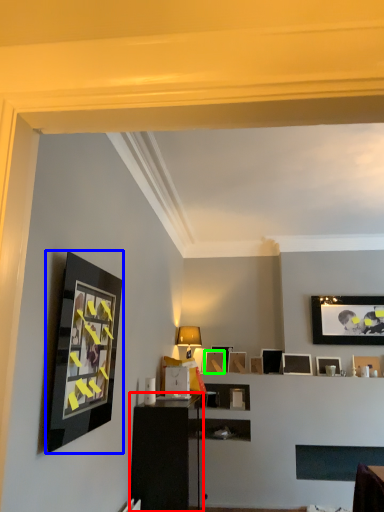
Question: Based on their relative distances, which object is farther from dresser (highlighted by a red box)? Choose from picture frame (highlighted by a blue box) and picture frame (highlighted by a green box).

Choices:
 (A) picture frame
 (B) picture frame

Answer: (B)